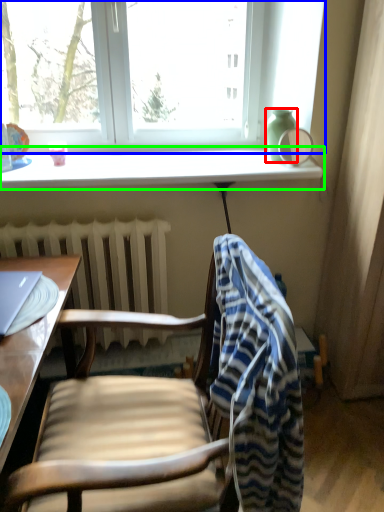
Question: Which object is the farthest from vase (highlighted by a red box)? Choose among these: window (highlighted by a blue box) or window sill (highlighted by a green box).

Choices:
 (A) window
 (B) window sill

Answer: (A)